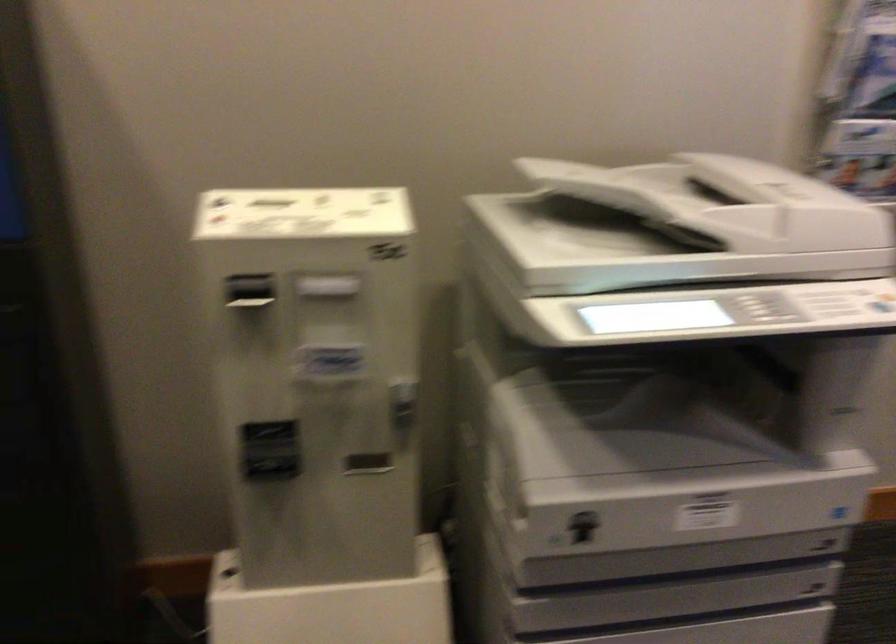
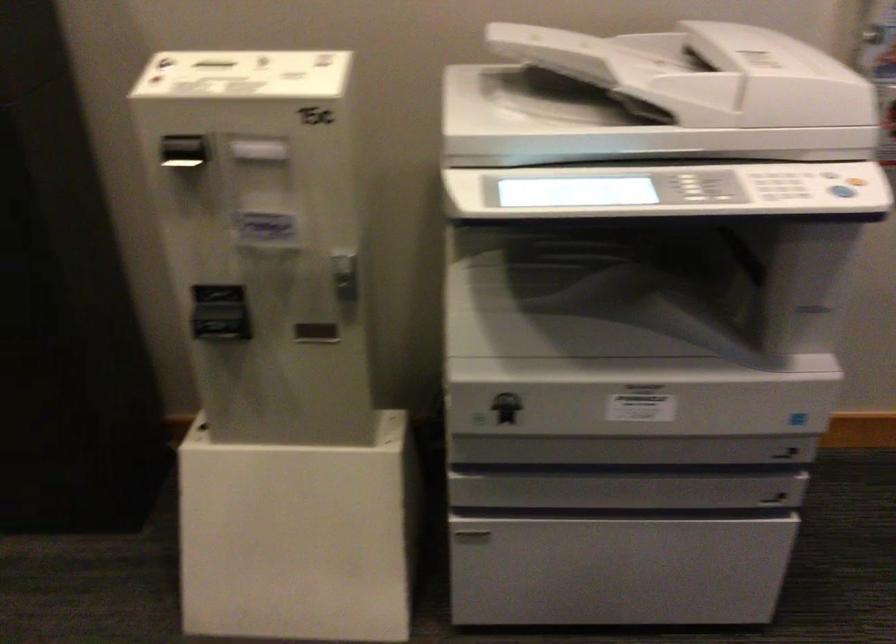
Find the pixel in the second image that matches pixel 366 464 in the first image.

(315, 333)